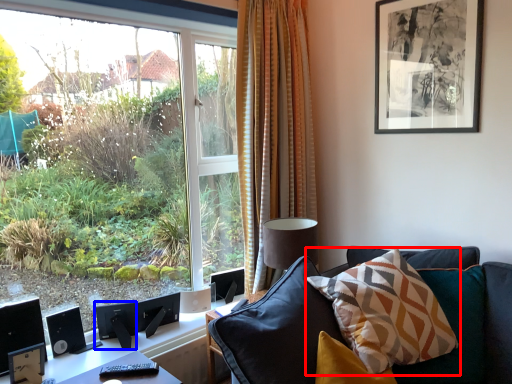
Question: Which object appears closest to the camera in this image, pillow (highlighted by a red box) or speaker (highlighted by a blue box)?

Choices:
 (A) pillow
 (B) speaker

Answer: (A)